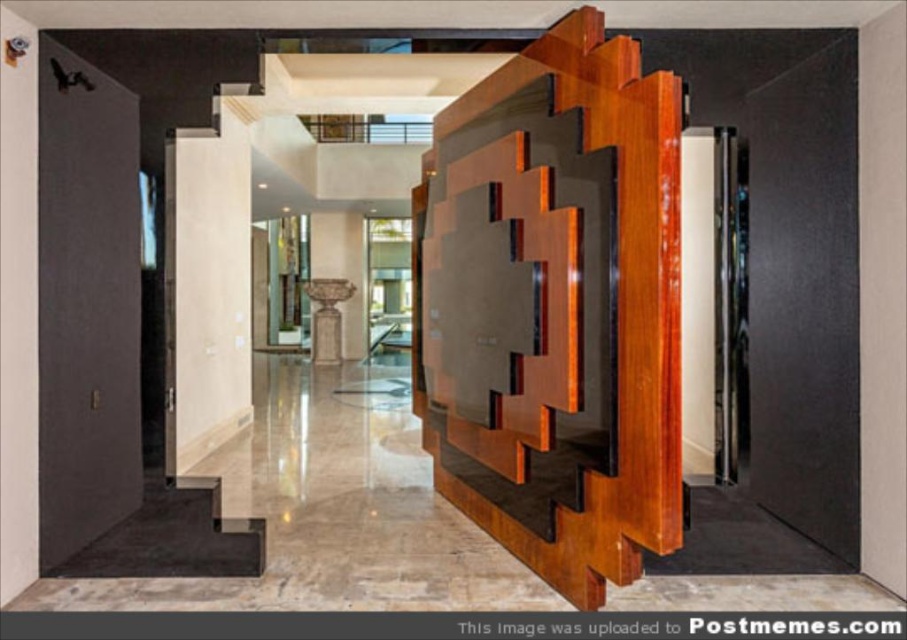
You are an interior designer planning to place a 2.5 meter wide sofa in this room. The shiny brown wood at center and the light wood door at center are both in your way. Which object do you need to move to make space for the sofa?

You need to move the shiny brown wood at center because its width is larger than the light wood door at center, making it the wider obstacle in the way of placing the sofa.

You are a delivery person trying to enter the room through the matte black door at left. The shiny brown wood at center is blocking your path. Can you walk around it to reach the door?

The shiny brown wood at center might be wider than matte black door at left, so it is possible that the shiny brown wood at center is too wide to walk around, making it difficult to reach the door.